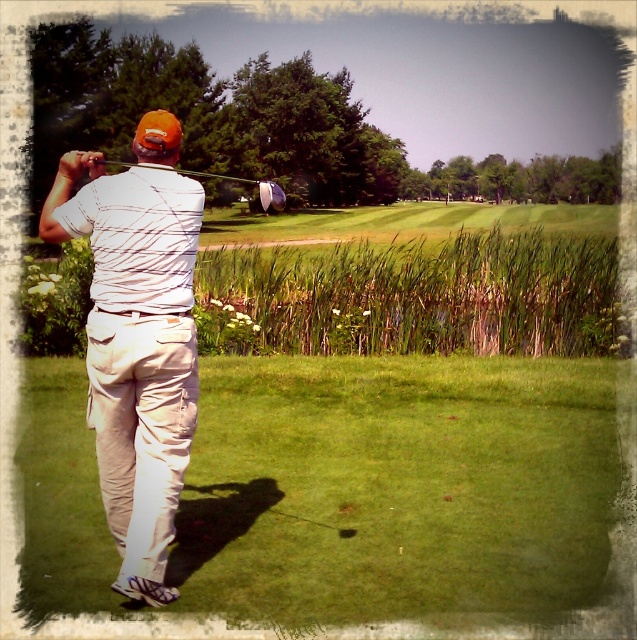
You are a spectator watching the golfer from behind. You notice the green grass at center and the white cotton shirt at center. Which object is positioned lower in the image?

The green grass at center is positioned below the white cotton shirt at center, so the green grass at center is lower in the image.

You are a golfer observing the scene. You see the green grass at center and the metallic silver golf club at upper center. Which object is positioned to the right of the other?

The green grass at center is to the right of the metallic silver golf club at upper center.

Where is the green grass at center located in the image?

The green grass at center is located at point [396,486] in the image.